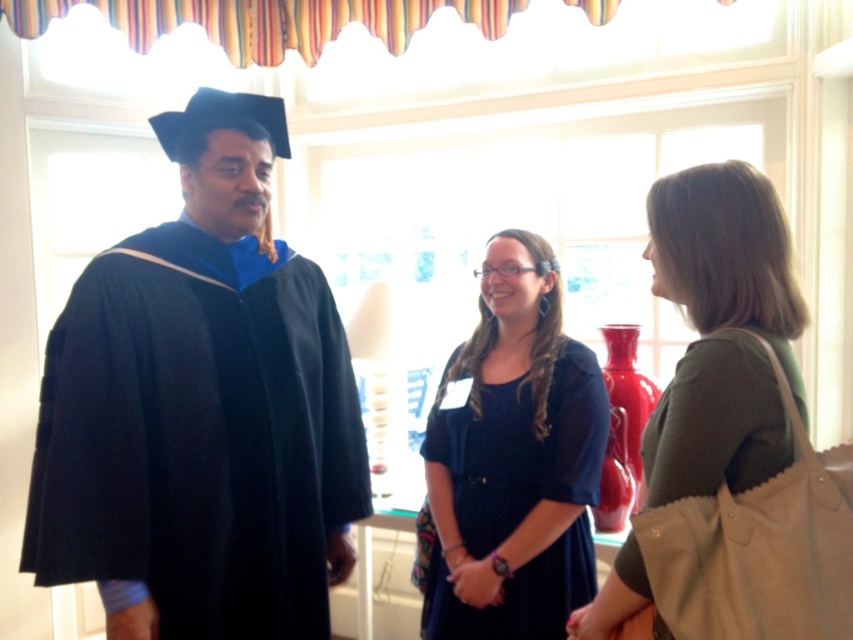
Based on the photo, can you confirm if matte black dress at center is taller than green fabric purse at right?

Yes.

Is matte black dress at center above green fabric purse at right?

Actually, matte black dress at center is below green fabric purse at right.

Who is more forward, (474, 470) or (753, 417)?

Point (753, 417)

At what (x,y) coordinates should I click in order to perform the action: click on matte black dress at center. Please return your answer as a coordinate pair (x, y). Image resolution: width=853 pixels, height=640 pixels. Looking at the image, I should click on (514, 460).

Can you confirm if matte black graduation gown at left is shorter than matte black dress at center?

No, matte black graduation gown at left is not shorter than matte black dress at center.

Looking at this image, is matte black graduation gown at left thinner than matte black dress at center?

Incorrect, matte black graduation gown at left's width is not less than matte black dress at center's.

Does point (141, 547) come behind point (538, 273)?

No, it is in front of (538, 273).

At what (x,y) coordinates should I click in order to perform the action: click on matte black graduation gown at left. Please return your answer as a coordinate pair (x, y). This screenshot has width=853, height=640. Looking at the image, I should click on (201, 410).

Can you confirm if matte black graduation gown at left is smaller than green fabric purse at right?

No.

Does point (167, 564) come in front of point (683, 403)?

No, it is not.

Between point (198, 545) and point (589, 637), which one is positioned behind?

The point (198, 545) is more distant.

This screenshot has width=853, height=640. What are the coordinates of `matte black graduation gown at left` in the screenshot? It's located at (201, 410).